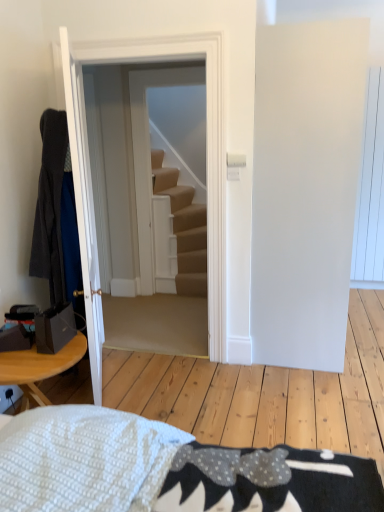
Question: From a real-world perspective, is carpeted stairs at center over white wooden door at center, the first door viewed from the right?

Choices:
 (A) no
 (B) yes

Answer: (A)

Question: Is carpeted stairs at center surrounding white wooden door at center, which appears as the 2th door when viewed from the left?

Choices:
 (A) yes
 (B) no

Answer: (B)

Question: Is there a large distance between carpeted stairs at center and white wooden door at center, which appears as the 2th door when viewed from the left?

Choices:
 (A) yes
 (B) no

Answer: (A)

Question: From the image's perspective, is carpeted stairs at center on top of white wooden door at center, the first door viewed from the right?

Choices:
 (A) yes
 (B) no

Answer: (A)

Question: Is carpeted stairs at center positioned with its back to white wooden door at center, the first door viewed from the right?

Choices:
 (A) no
 (B) yes

Answer: (A)

Question: Is carpeted stairs at center smaller than white wooden door at center, which appears as the 2th door when viewed from the left?

Choices:
 (A) no
 (B) yes

Answer: (B)

Question: Is carpeted stairs at center positioned behind dark gray fabric robe at left?

Choices:
 (A) yes
 (B) no

Answer: (A)

Question: Is dark gray fabric robe at left completely or partially inside carpeted stairs at center?

Choices:
 (A) yes
 (B) no

Answer: (B)

Question: Is carpeted stairs at center in front of dark gray fabric robe at left?

Choices:
 (A) yes
 (B) no

Answer: (B)

Question: Could you tell me if carpeted stairs at center is turned towards dark gray fabric robe at left?

Choices:
 (A) no
 (B) yes

Answer: (B)

Question: From a real-world perspective, is carpeted stairs at center physically below dark gray fabric robe at left?

Choices:
 (A) yes
 (B) no

Answer: (A)

Question: Are carpeted stairs at center and dark gray fabric robe at left beside each other?

Choices:
 (A) no
 (B) yes

Answer: (A)

Question: Is white wooden door at center, which appears as the 2th door when viewed from the left, with carpeted stairs at center?

Choices:
 (A) yes
 (B) no

Answer: (B)